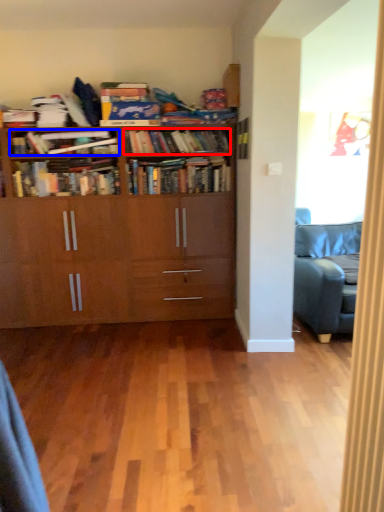
Question: Which point is further to the camera, book (highlighted by a red box) or book (highlighted by a blue box)?

Choices:
 (A) book
 (B) book

Answer: (A)